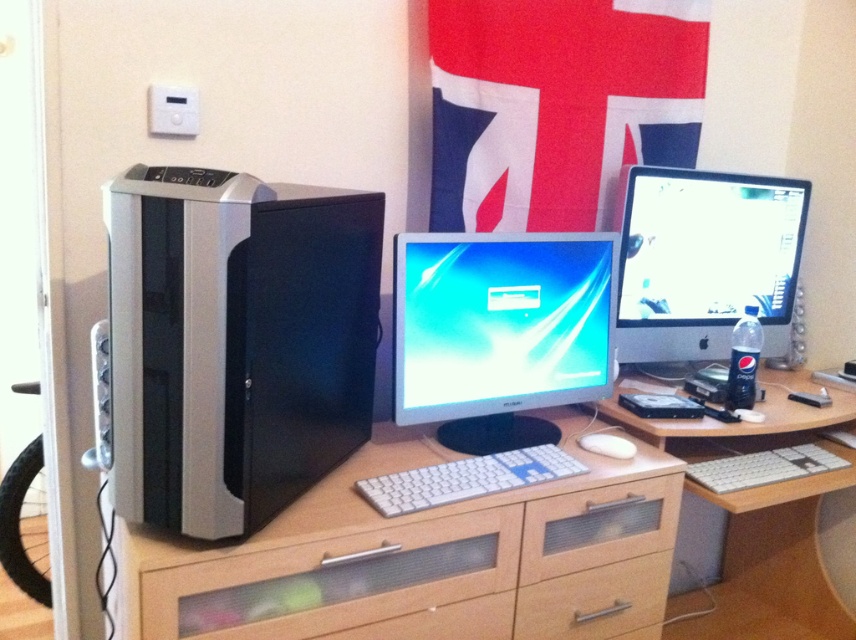
Question: Does satin silver monitor at center right have a larger size compared to white plastic keyboard at lower right?

Choices:
 (A) no
 (B) yes

Answer: (B)

Question: Which object appears farthest from the camera in this image?

Choices:
 (A) satin silver monitor at center right
 (B) light brown wood desk at center
 (C) wooden at left
 (D) white plastic keyboard at center

Answer: (A)

Question: Which object is the closest to the textured fabric flag at upper center?

Choices:
 (A) satin silver monitor at center right
 (B) white matte mouse at center

Answer: (A)

Question: Is clear plastic drawer at center further to the viewer compared to black plastic speaker at right?

Choices:
 (A) yes
 (B) no

Answer: (B)

Question: Is the position of wooden at left less distant than that of wooden drawer at center?

Choices:
 (A) yes
 (B) no

Answer: (A)

Question: Which object appears farthest from the camera in this image?

Choices:
 (A) light brown wood desk at center
 (B) textured fabric flag at upper center
 (C) transparent glass drawer at center
 (D) wooden drawer at center

Answer: (B)